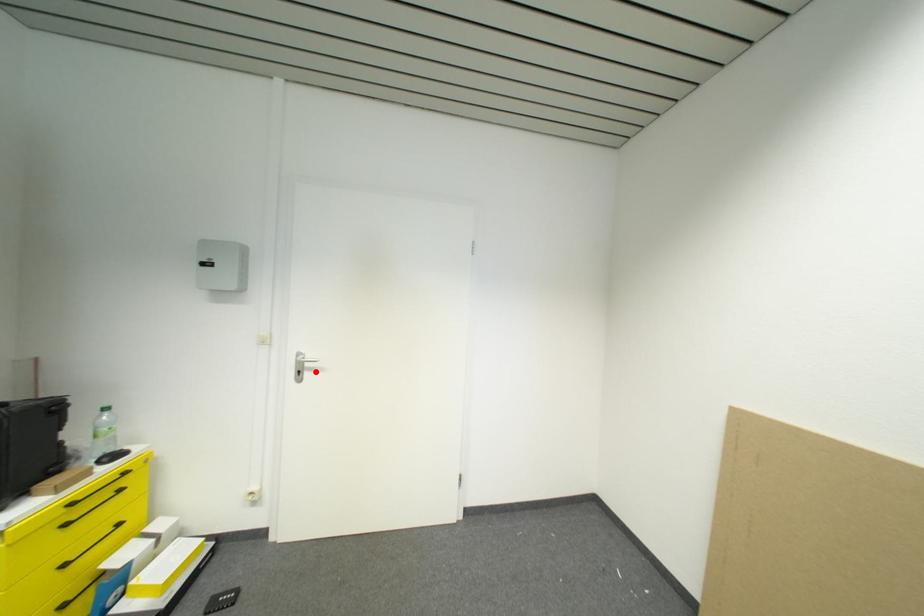
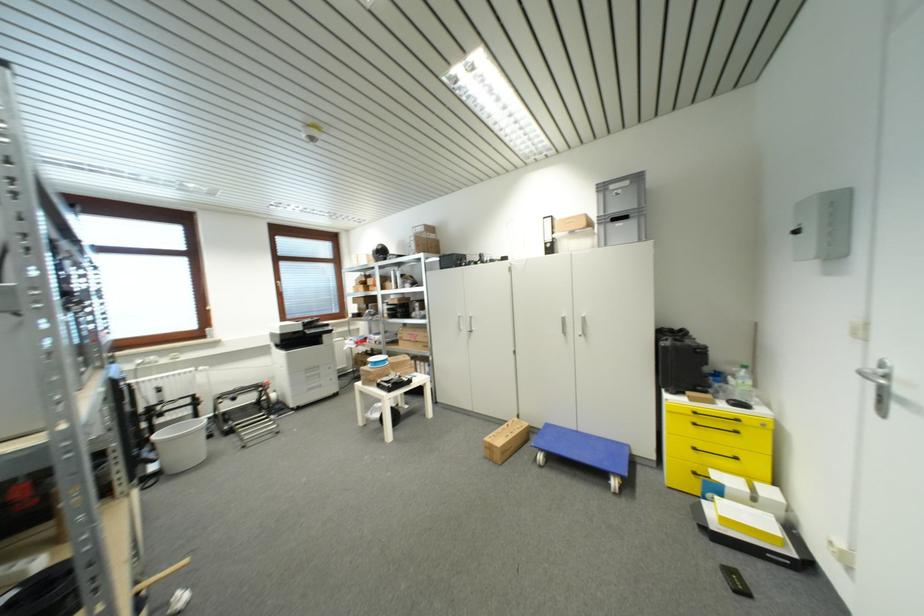
Locate, in the second image, the point that corresponds to the highlighted location in the first image.

(909, 405)